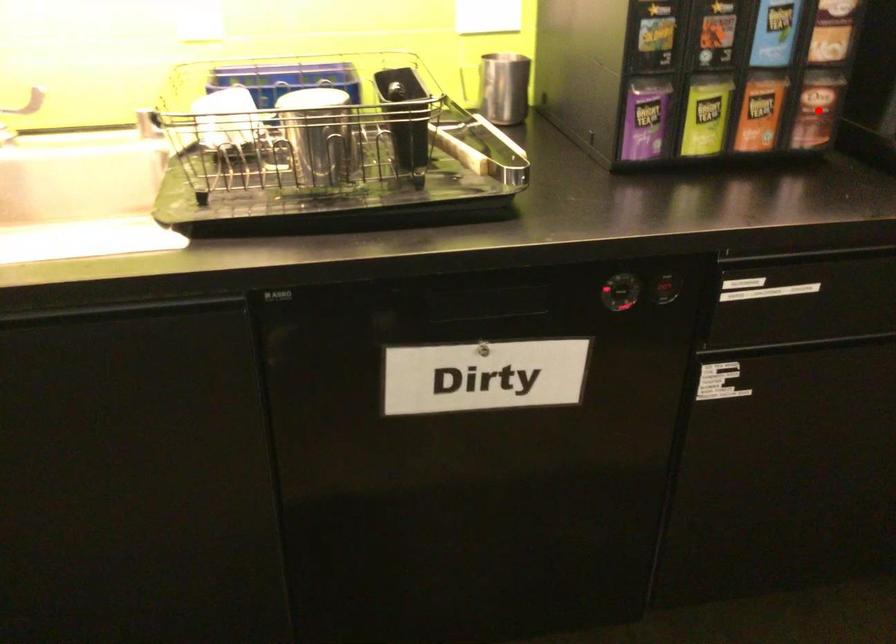
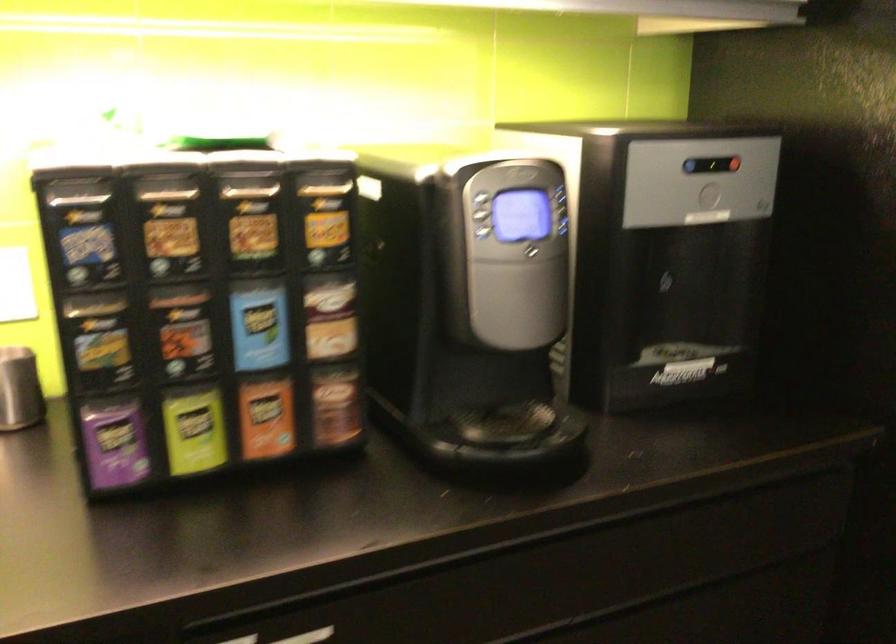
Question: I am providing you with two images of the same scene from different viewpoints. Given a red point in image1, look at the same physical point in image2. Is it:

Choices:
 (A) Closer to the viewpoint
 (B) Farther from the viewpoint

Answer: (A)